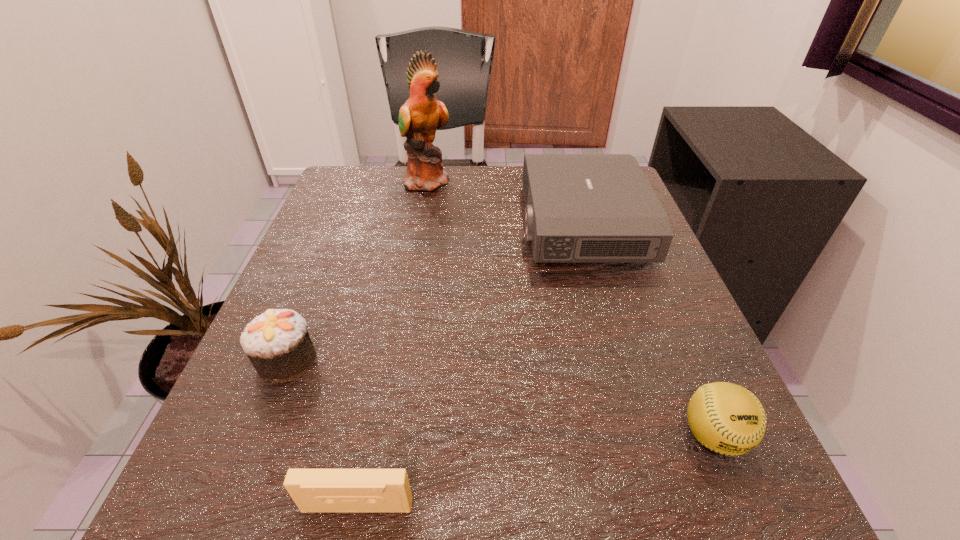
Where is `free spot that satisfies the following two spatial constraints: 1. on the front-facing side of the projector; 2. at the front of the nearest object with spools`? This screenshot has width=960, height=540. free spot that satisfies the following two spatial constraints: 1. on the front-facing side of the projector; 2. at the front of the nearest object with spools is located at coordinates (662, 506).

The image size is (960, 540). Identify the location of vacant space that satisfies the following two spatial constraints: 1. on the front-facing side of the parrot; 2. at the front of the nearest object with spools. (372, 506).